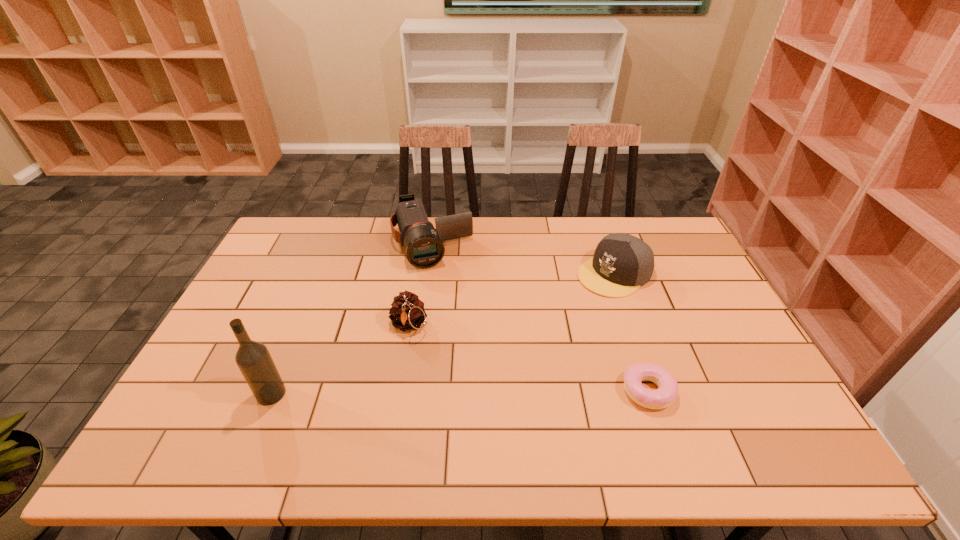
Where is `vacant area that lies between the camcorder and the pinecone`? The image size is (960, 540). vacant area that lies between the camcorder and the pinecone is located at coordinates (420, 284).

The width and height of the screenshot is (960, 540). What are the coordinates of `free space between the cap and the camcorder` in the screenshot? It's located at (523, 258).

Locate an element on the screen. The image size is (960, 540). vacant point located between the camcorder and the leftmost object is located at coordinates (351, 318).

The image size is (960, 540). I want to click on unoccupied area between the cap and the camcorder, so click(523, 258).

Select which object is the third closest to the third nearest object. Please provide its 2D coordinates. Your answer should be formatted as a tuple, i.e. [(x, y)], where the tuple contains the x and y coordinates of a point satisfying the conditions above.

[(622, 263)]

Identify the location of the closest object relative to the third farthest object. The height and width of the screenshot is (540, 960). (423, 243).

Identify the location of free space that satisfies the following two spatial constraints: 1. on the front side of the camcorder; 2. on the right side of the cap. The width and height of the screenshot is (960, 540). (428, 273).

In order to click on vacant point that satisfies the following two spatial constraints: 1. on the back side of the cap; 2. on the left side of the vodka in this screenshot , I will do `click(322, 273)`.

Where is `free space in the image that satisfies the following two spatial constraints: 1. on the back side of the cap; 2. on the right side of the vodka`? free space in the image that satisfies the following two spatial constraints: 1. on the back side of the cap; 2. on the right side of the vodka is located at coordinates pos(322,273).

The height and width of the screenshot is (540, 960). I want to click on free space that satisfies the following two spatial constraints: 1. on the front side of the doughnut; 2. on the left side of the pinecone, so click(397, 391).